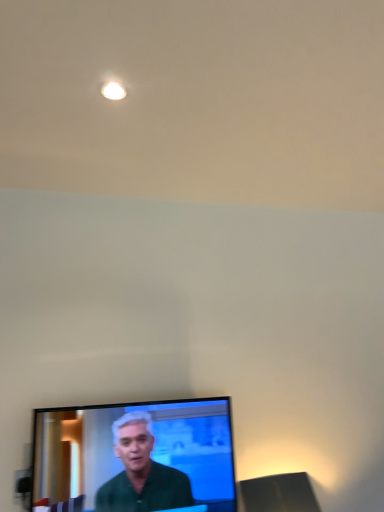
The image size is (384, 512). What do you see at coordinates (137, 455) in the screenshot?
I see `green glossy television at lower center` at bounding box center [137, 455].

Consider the image. In order to face green glossy television at lower center, should I rotate leftwards or rightwards?

Turn left by 6.943 degrees to look at green glossy television at lower center.

At what (x,y) coordinates should I click in order to perform the action: click on green glossy television at lower center. Please return your answer as a coordinate pair (x, y). This screenshot has width=384, height=512. Looking at the image, I should click on (137, 455).

You are a GUI agent. You are given a task and a screenshot of the screen. Output one action in this format:
    pyautogui.click(x=<x>, y=<y>)
    Task: Click on the green glossy television at lower center
    The width and height of the screenshot is (384, 512).
    Given the screenshot: What is the action you would take?
    pyautogui.click(x=137, y=455)